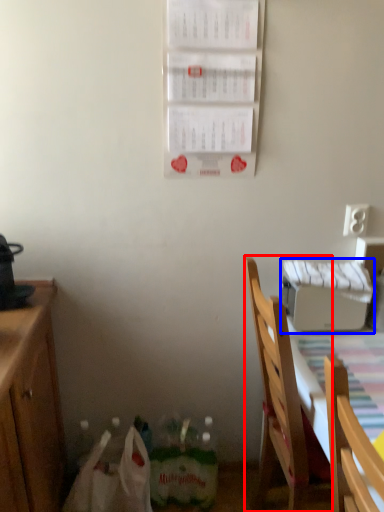
Question: Which object appears closest to the camera in this image, chair (highlighted by a red box) or appliance (highlighted by a blue box)?

Choices:
 (A) chair
 (B) appliance

Answer: (A)